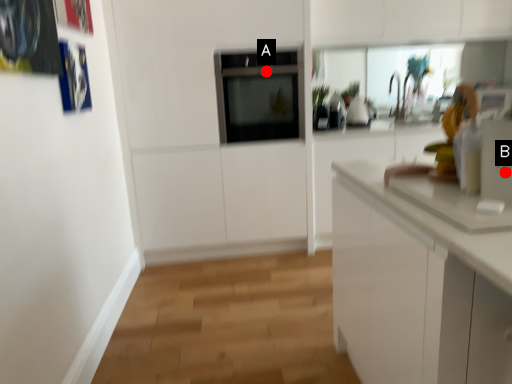
Question: Two points are circled on the image, labeled by A and B beside each circle. Which point is closer to the camera taking this photo?

Choices:
 (A) A is closer
 (B) B is closer

Answer: (B)